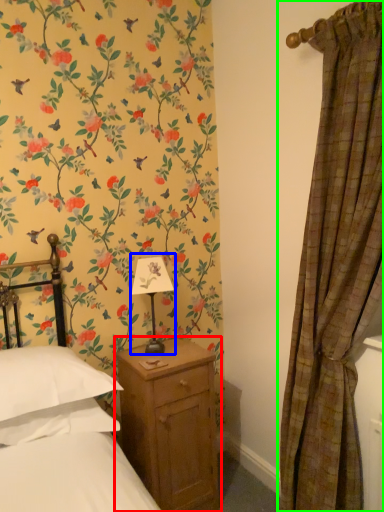
Question: Based on their relative distances, which object is nearer to nightstand (highlighted by a red box)? Choose from table lamp (highlighted by a blue box) and curtain (highlighted by a green box).

Choices:
 (A) table lamp
 (B) curtain

Answer: (A)